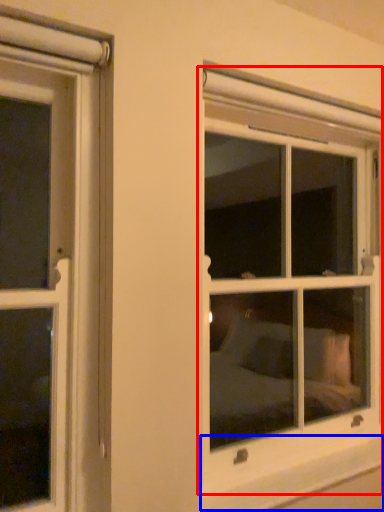
Question: Among these objects, which one is farthest to the camera, window (highlighted by a red box) or window sill (highlighted by a blue box)?

Choices:
 (A) window
 (B) window sill

Answer: (A)